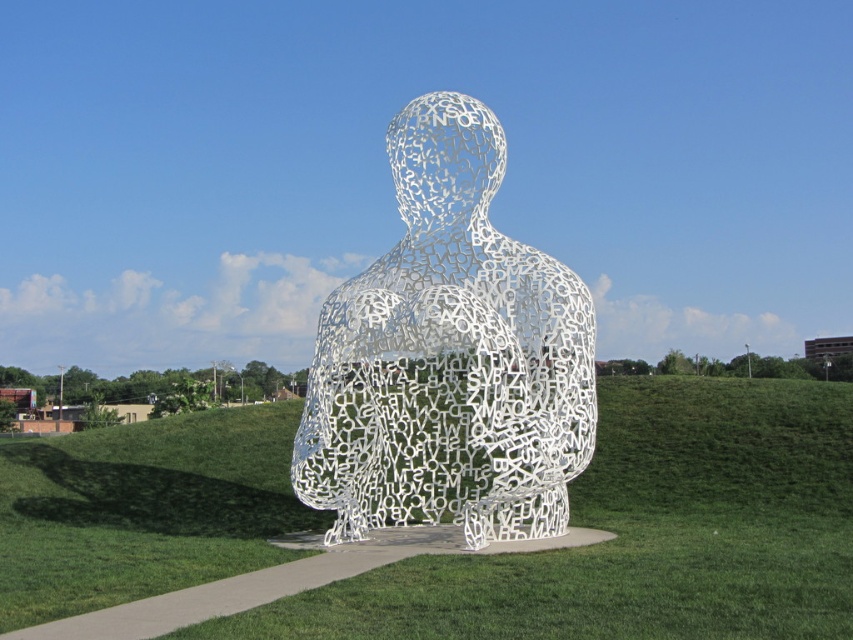
You are a gardener who needs to mow the green grass at center. To reach the grass, you must pass through the white metallic sculpture at center. Is the pathway between them wide enough for your lawnmower, which is 1 meter wide?

The green grass at center is positioned on the left side of white metallic sculpture at center, so the pathway between them is wide enough for the lawnmower since it is only 1 meter wide.

You are a gardener planning to mow the green grass at center and the white metallic sculpture at center. Which area is wider?

The green grass at center is wider than the white metallic sculpture at center.